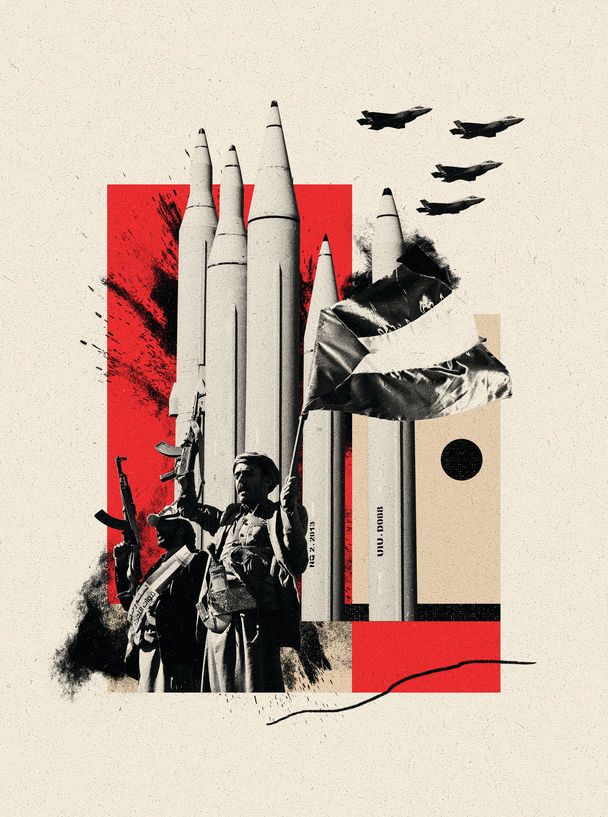
Identify the location of art. The height and width of the screenshot is (817, 608). (233, 467).